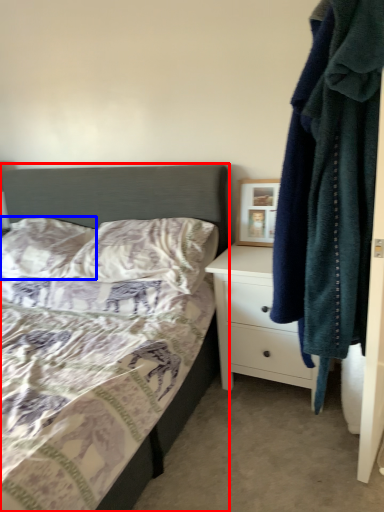
Question: Which point is further to the camera, bed (highlighted by a red box) or pillow (highlighted by a blue box)?

Choices:
 (A) bed
 (B) pillow

Answer: (B)